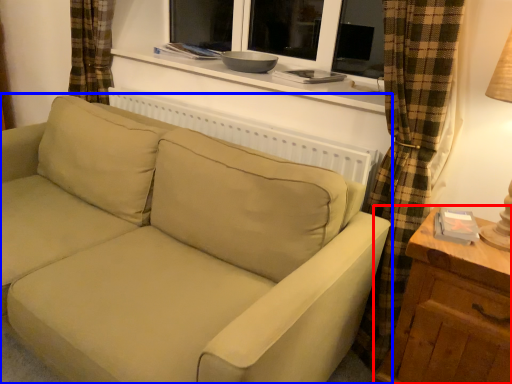
Question: Among these objects, which one is nearest to the camera, table (highlighted by a red box) or studio couch (highlighted by a blue box)?

Choices:
 (A) table
 (B) studio couch

Answer: (B)